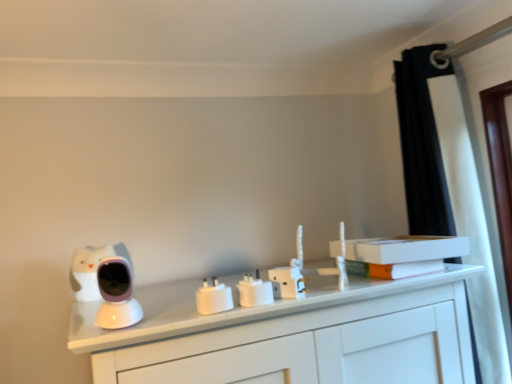
Question: Is white plastic electric outlet at center, the 3th electric outlet in the left-to-right sequence, positioned beyond the bounds of white plastic electric outlet at center, the second electric outlet in the right-to-left sequence?

Choices:
 (A) no
 (B) yes

Answer: (B)

Question: Does white plastic electric outlet at center, the 3th electric outlet in the left-to-right sequence, have a lesser width compared to white plastic electric outlet at center, the second electric outlet in the right-to-left sequence?

Choices:
 (A) yes
 (B) no

Answer: (A)

Question: Is white plastic electric outlet at center, the 3th electric outlet in the left-to-right sequence, looking in the opposite direction of white plastic electric outlet at center, the second electric outlet in the right-to-left sequence?

Choices:
 (A) no
 (B) yes

Answer: (A)

Question: Is white plastic electric outlet at center, the 3th electric outlet in the left-to-right sequence, shorter than white plastic electric outlet at center, the second electric outlet from the left?

Choices:
 (A) no
 (B) yes

Answer: (A)

Question: From a real-world perspective, is white plastic electric outlet at center, which is counted as the 1th electric outlet, starting from the right, positioned under white plastic electric outlet at center, the second electric outlet from the left, based on gravity?

Choices:
 (A) yes
 (B) no

Answer: (B)

Question: Is white plastic electric outlet at center, the 3th electric outlet in the left-to-right sequence, oriented towards white plastic electric outlet at center, the second electric outlet from the left?

Choices:
 (A) no
 (B) yes

Answer: (A)

Question: Is white plastic electric outlet at center, the second electric outlet from the left, aimed at white plastic power adapter at center, which is the third electric outlet in right-to-left order?

Choices:
 (A) yes
 (B) no

Answer: (B)

Question: Is white plastic electric outlet at center, the second electric outlet in the right-to-left sequence, at the left side of white plastic power adapter at center, which is the third electric outlet in right-to-left order?

Choices:
 (A) yes
 (B) no

Answer: (B)

Question: From the image's perspective, is white plastic electric outlet at center, the second electric outlet from the left, under white plastic power adapter at center, which is the third electric outlet in right-to-left order?

Choices:
 (A) no
 (B) yes

Answer: (A)

Question: Does white plastic electric outlet at center, the second electric outlet in the right-to-left sequence, have a greater height compared to white plastic power adapter at center, which is the third electric outlet in right-to-left order?

Choices:
 (A) no
 (B) yes

Answer: (B)

Question: Does white plastic electric outlet at center, the second electric outlet in the right-to-left sequence, have a larger size compared to white plastic power adapter at center, which is the 1th electric outlet from left to right?

Choices:
 (A) yes
 (B) no

Answer: (A)

Question: Could white plastic power adapter at center, which is the 1th electric outlet from left to right, be considered to be inside white plastic electric outlet at center, the second electric outlet from the left?

Choices:
 (A) yes
 (B) no

Answer: (B)

Question: From a real-world perspective, is black fabric curtain at upper right under orange matte book at upper right, which is the 2th book in top-to-bottom order?

Choices:
 (A) no
 (B) yes

Answer: (A)